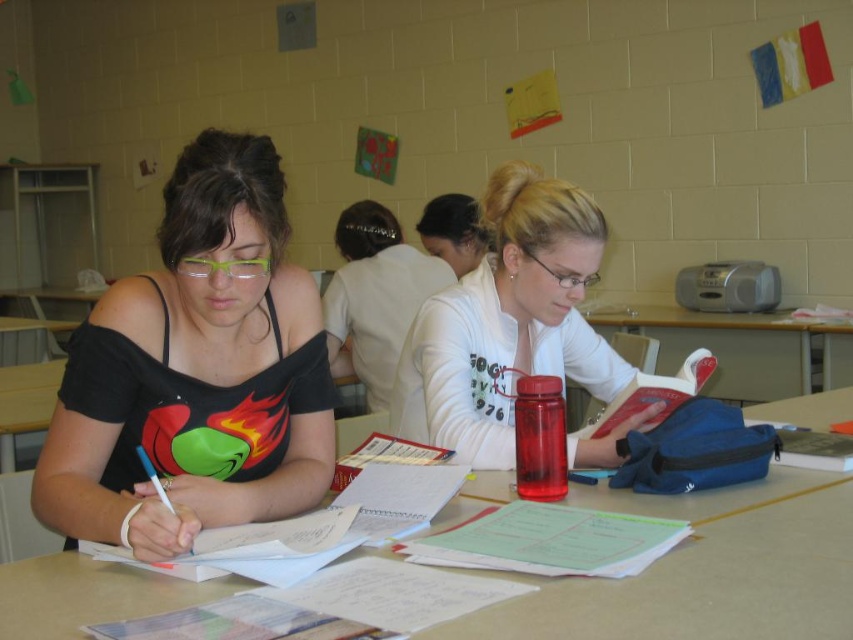
You are a tailor measuring clothing items for alterations. You have a tailor measuring tape and need to determine which clothing item requires more fabric for alterations between the black matte tank top at left and the white matte sweater at center. Based on their sizes, which one would need more fabric?

The black matte tank top at left requires more fabric for alterations because its width is larger than the white matte sweater at center.

You need to place a new item on the desk between the white paper at center and the blue fabric backpack at right. Which object should you place it closer to if you want it to be closer to the smaller object?

You should place the new item closer to the white paper at center because it is smaller than the blue fabric backpack at right according to the description.

In the scene shown: You are a student who needs to place a white paper at center and a blue fabric backpack at right on a desk. Which object should you place first if you want to ensure both fit without overlapping?

The white paper at center might be wider than blue fabric backpack at right, so you should place the white paper at center first to accommodate its width before placing the blue fabric backpack at right.